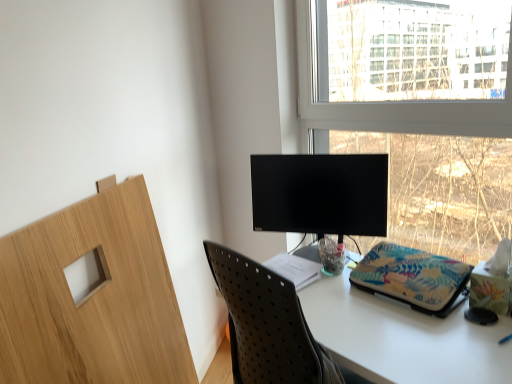
Question: From a real-world perspective, is floral fabric laptop sleeve at center above or below white paper at center?

Choices:
 (A) below
 (B) above

Answer: (B)

Question: Is floral fabric laptop sleeve at center spatially inside white paper at center, or outside of it?

Choices:
 (A) inside
 (B) outside

Answer: (B)

Question: Which of these objects is positioned closest to the black matte monitor at center?

Choices:
 (A) white matte table at center
 (B) floral fabric laptop sleeve at center
 (C) transparent glass window at upper right
 (D) white paper at center

Answer: (D)

Question: Which is farther from the white paper at center?

Choices:
 (A) floral fabric laptop sleeve at center
 (B) transparent glass window at upper right
 (C) black matte monitor at center
 (D) white matte table at center

Answer: (B)